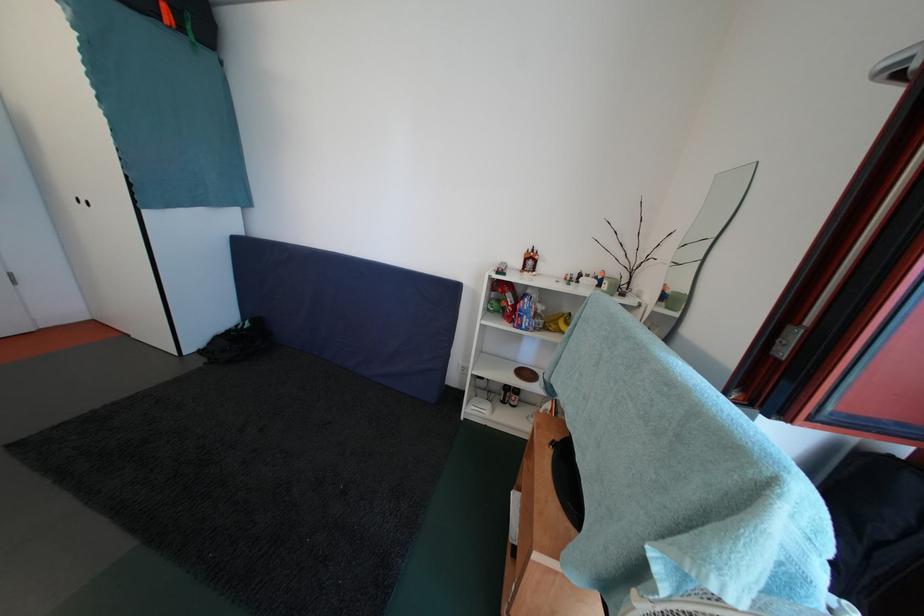
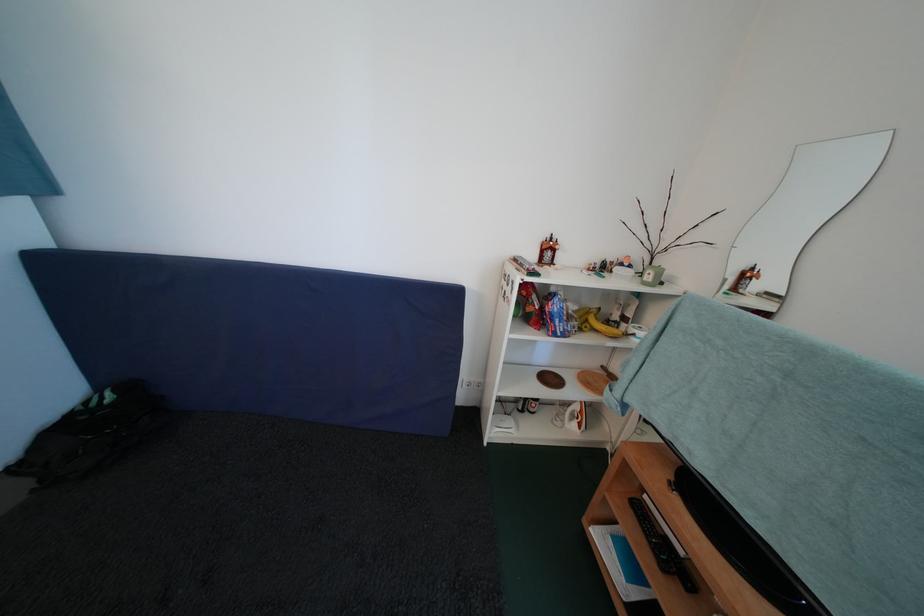
The point at (554, 411) is marked in the first image. Where is the corresponding point in the second image?

(584, 411)